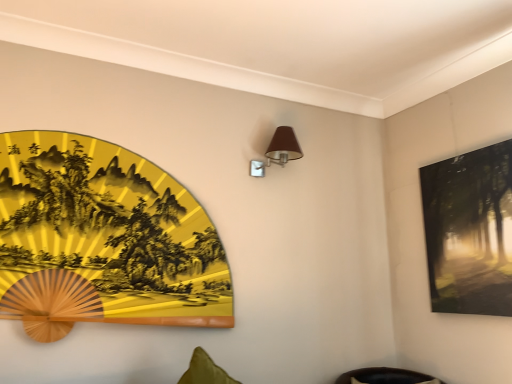
Question: From a real-world perspective, is brown fabric table lamp at upper center above or below matte black painting at upper right, which is the first picture frame from right to left?

Choices:
 (A) below
 (B) above

Answer: (B)

Question: From the image's perspective, is brown fabric table lamp at upper center located above or below matte black painting at upper right, which is the first picture frame from right to left?

Choices:
 (A) above
 (B) below

Answer: (A)

Question: Which object is positioned closest to the brown fabric table lamp at upper center?

Choices:
 (A) gold lacquered fan at left, the 2th picture frame from the right
 (B) matte black painting at upper right, which is the first picture frame from right to left

Answer: (A)

Question: Based on their relative distances, which object is nearer to the gold lacquered fan at left, the 1th picture frame from the left?

Choices:
 (A) matte black painting at upper right, which is the first picture frame from right to left
 (B) brown fabric table lamp at upper center

Answer: (B)